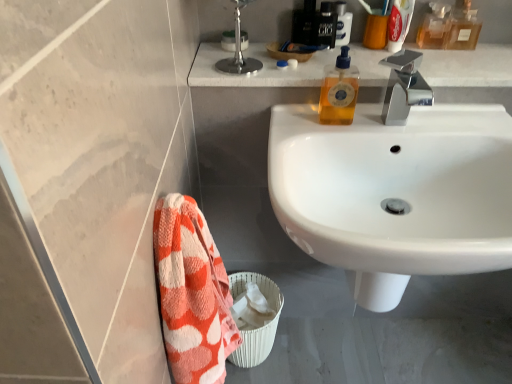
Locate an element on the screen. Image resolution: width=512 pixels, height=384 pixels. vacant area that is in front of white plastic toothpaste tube at upper right, the third mouthwash in the right-to-left sequence is located at coordinates (411, 66).